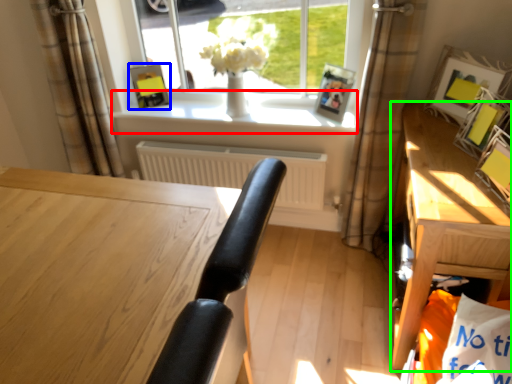
Question: Estimate the real-world distances between objects in this image. Which object is closer to window sill (highlighted by a red box), picture frame (highlighted by a blue box) or table (highlighted by a green box)?

Choices:
 (A) picture frame
 (B) table

Answer: (A)